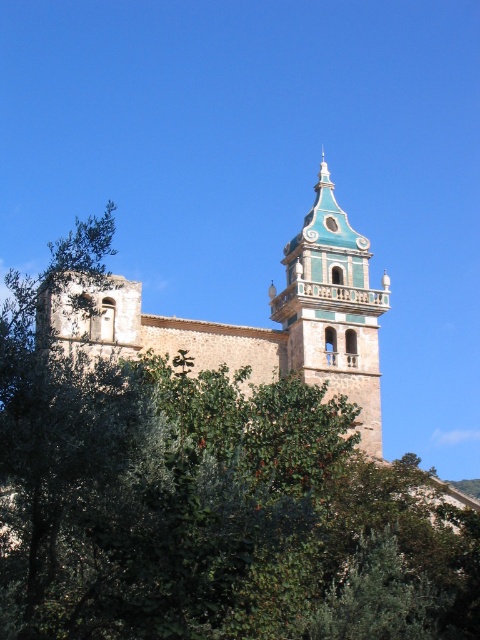
Image resolution: width=480 pixels, height=640 pixels. Describe the element at coordinates (204, 499) in the screenshot. I see `green leafy tree at center` at that location.

Does point (361, 545) come behind point (277, 348)?

That is False.

Find the location of a particular element. This screenshot has width=480, height=640. green leafy tree at center is located at coordinates (204, 499).

Which is more to the left, light brown stone church at center or blue-green glazed bell tower at center?

light brown stone church at center

Does light brown stone church at center appear on the left side of blue-green glazed bell tower at center?

Indeed, light brown stone church at center is positioned on the left side of blue-green glazed bell tower at center.

Does point (362, 237) lie in front of point (287, 310)?

No.

Image resolution: width=480 pixels, height=640 pixels. Find the location of `light brown stone church at center`. light brown stone church at center is located at coordinates (269, 317).

From the picture: Can you confirm if green leafy tree at center is bigger than blue-green glazed bell tower at center?

Yes, green leafy tree at center is bigger than blue-green glazed bell tower at center.

Is point (23, 579) farther from viewer compared to point (287, 353)?

No.

I want to click on green leafy tree at center, so click(x=204, y=499).